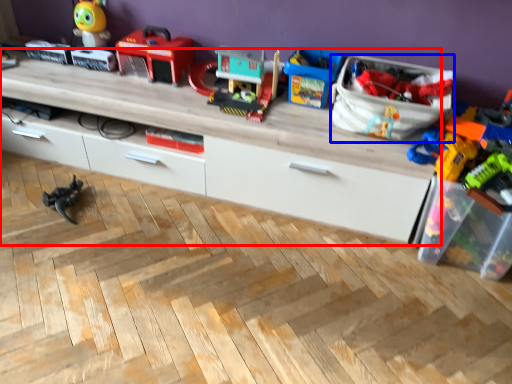
Question: Which object appears closest to the camera in this image, entertainment center (highlighted by a red box) or storage box (highlighted by a blue box)?

Choices:
 (A) entertainment center
 (B) storage box

Answer: (B)